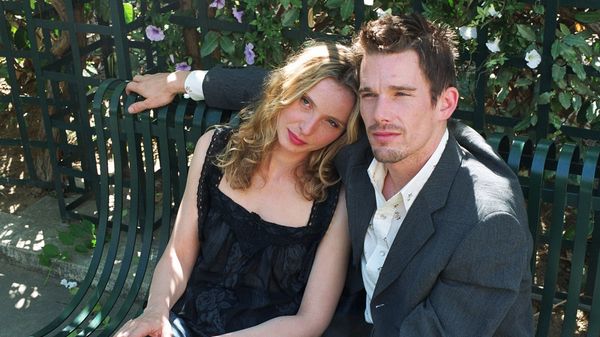
What are the coordinates of `ledge` in the screenshot? It's located at (31, 241).